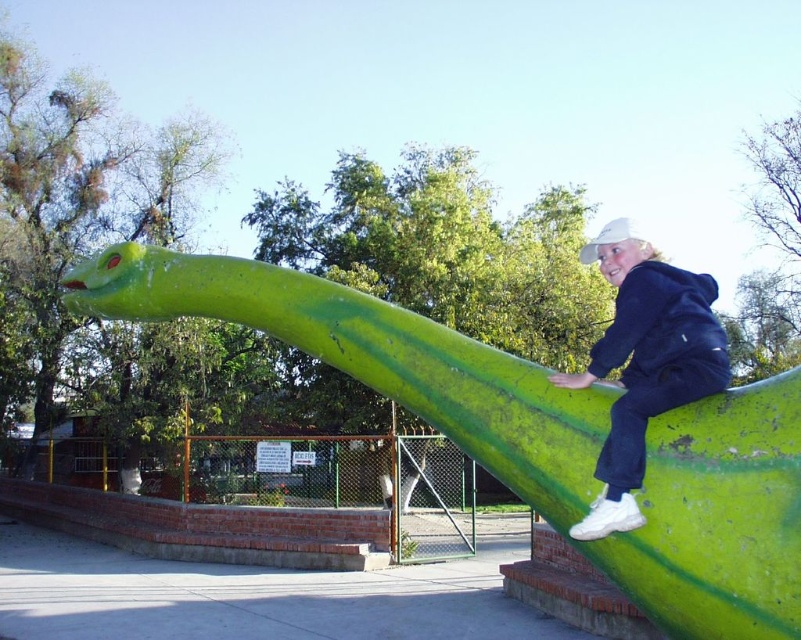
Between green matte slide at upper right and white matte sneakers at upper right, which one appears on the left side from the viewer's perspective?

green matte slide at upper right is more to the left.

The width and height of the screenshot is (801, 640). What do you see at coordinates (377, 362) in the screenshot? I see `green matte slide at upper right` at bounding box center [377, 362].

You are a GUI agent. You are given a task and a screenshot of the screen. Output one action in this format:
    pyautogui.click(x=<x>, y=<y>)
    Task: Click on the green matte slide at upper right
    
    Given the screenshot: What is the action you would take?
    pyautogui.click(x=377, y=362)